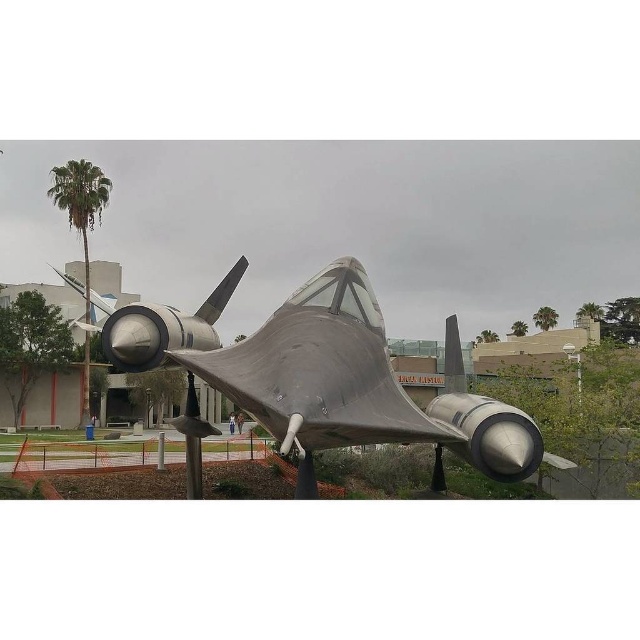
You are a photographer planning to capture the polished silver aircraft at center and the green leafy palm tree at left in a single shot. Which object will appear narrower in the photo?

The polished silver aircraft at center will appear narrower in the photo because it is thinner than the green leafy palm tree at left.

You are standing in the museum exhibit and want to take a photo of the aircraft. The point you need to focus on is point (72, 204). If your camera has a maximum focus range of 30 meters, will you be able to focus on that point?

The distance of point (72, 204) from the camera is 28.95 meters, which is within the camera maximum focus range of 30 meters. Therefore, you can focus on that point.

You are standing in front of the futuristic aircraft at the museum. You notice two points marked on the aircraft. The first point is at coordinates point (276, 380) and the second is at point (56, 172). Which point is closer to you?

Point (276, 380) is closer to the viewer than point (56, 172).